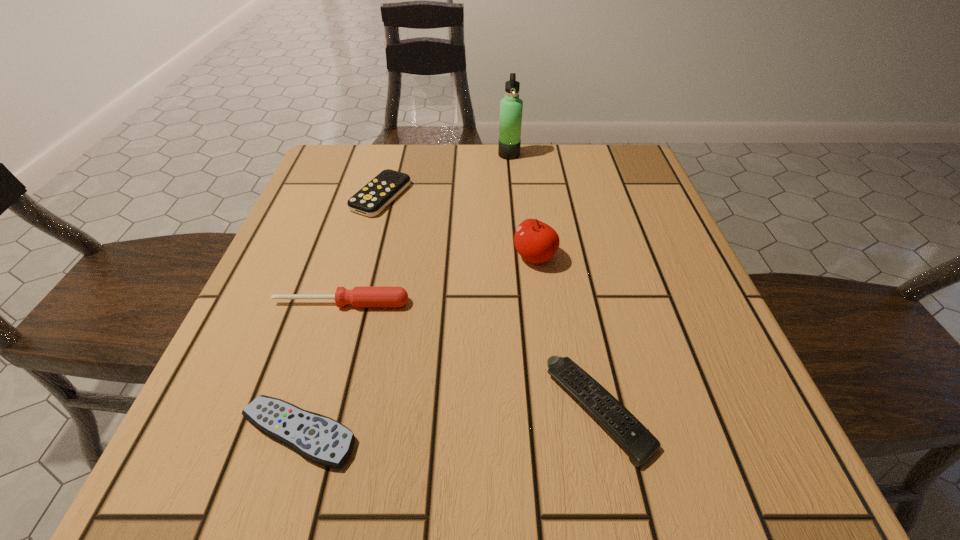
This screenshot has width=960, height=540. What are the coordinates of `free space located on the back of the fifth shortest object` in the screenshot? It's located at click(x=523, y=169).

What are the coordinates of `free location located on the front of the third tallest object` in the screenshot? It's located at (309, 414).

Find the location of `free spot located on the right of the farthest remote control`. free spot located on the right of the farthest remote control is located at coordinates (481, 196).

At what (x,y) coordinates should I click in order to perform the action: click on vacant area situated on the back of the rightmost remote control. Please return your answer as a coordinate pair (x, y). Looking at the image, I should click on (577, 302).

Find the location of a particular element. The width and height of the screenshot is (960, 540). free region located 0.220m on the back of the shortest remote control is located at coordinates point(343,288).

Find the location of `thermos bottle present at the far edge`. thermos bottle present at the far edge is located at coordinates (511, 106).

You are a GUI agent. You are given a task and a screenshot of the screen. Output one action in this format:
    pyautogui.click(x=<x>, y=<y>)
    Task: Click on the remote control located at the far edge
    This screenshot has height=540, width=960.
    Given the screenshot: What is the action you would take?
    pyautogui.click(x=376, y=195)

Find the location of a particular element. This screenshot has width=960, height=540. screwdriver that is at the left edge is located at coordinates (359, 296).

The width and height of the screenshot is (960, 540). I want to click on object that is at the right edge, so click(x=636, y=440).

The width and height of the screenshot is (960, 540). In order to click on object present at the far left corner in this screenshot , I will do `click(376, 195)`.